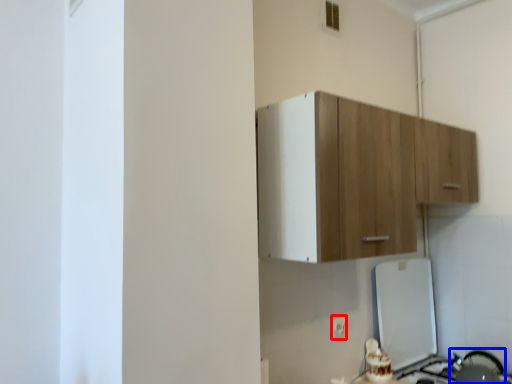
Question: Which of the following is the farthest to the observer, electric outlet (highlighted by a red box) or appliance (highlighted by a blue box)?

Choices:
 (A) electric outlet
 (B) appliance

Answer: (A)